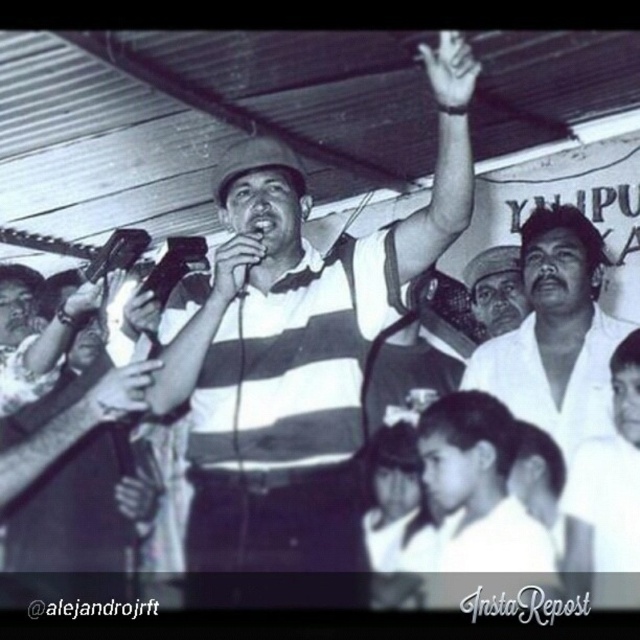
Which is more to the right, metallic shiny microphone at center or matte black hand at upper left?

From the viewer's perspective, metallic shiny microphone at center appears more on the right side.

Is metallic shiny microphone at center to the right of matte black hand at upper left from the viewer's perspective?

Indeed, metallic shiny microphone at center is positioned on the right side of matte black hand at upper left.

Who is more forward, [129,243] or [99,282]?

Positioned in front is point [99,282].

Where is `metallic shiny microphone at center`? This screenshot has width=640, height=640. metallic shiny microphone at center is located at coordinates (116, 252).

Is metallic shiny microphone at center closer to the viewer compared to matte black hand at upper center?

No, metallic shiny microphone at center is further to the viewer.

Who is shorter, metallic shiny microphone at center or matte black hand at upper center?

matte black hand at upper center is shorter.

Where is `metallic shiny microphone at center`? The image size is (640, 640). metallic shiny microphone at center is located at coordinates (116, 252).

Describe the element at coordinates (556, 333) in the screenshot. The image size is (640, 640). I see `white matte shirt at center` at that location.

Between white matte shirt at center and matte black hand at upper left, which one has more height?

Standing taller between the two is white matte shirt at center.

Is point (573, 212) closer to viewer compared to point (102, 285)?

No, (573, 212) is behind (102, 285).

Locate an element on the screen. The height and width of the screenshot is (640, 640). white matte shirt at center is located at coordinates (556, 333).